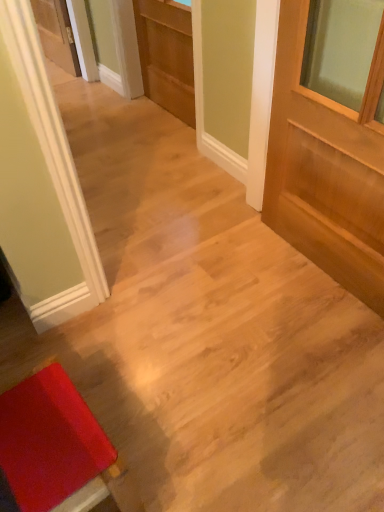
Find the location of a particular element. The height and width of the screenshot is (512, 384). rubberized red stool at lower left is located at coordinates (58, 449).

Identify the location of light brown wood door at right, which appears as the second door when viewed from the left. The image size is (384, 512). (326, 168).

Between light brown wood door at right, which ranks as the 2th door in back-to-front order, and rubberized red stool at lower left, which one has less height?

With less height is rubberized red stool at lower left.

From the image's perspective, is light brown wood door at right, the first door when ordered from front to back, under rubberized red stool at lower left?

Actually, light brown wood door at right, the first door when ordered from front to back, appears above rubberized red stool at lower left in the image.

Considering the sizes of objects light brown wood door at right, the first door when ordered from front to back, and rubberized red stool at lower left in the image provided, who is bigger, light brown wood door at right, the first door when ordered from front to back, or rubberized red stool at lower left?

Bigger between the two is light brown wood door at right, the first door when ordered from front to back.

From a real-world perspective, which object stands above the other?

light brown wood door at right, which ranks as the first door in right-to-left order, is physically above.

Between light brown wood door at center, acting as the 2th door starting from the front, and rubberized red stool at lower left, which one appears on the right side from the viewer's perspective?

From the viewer's perspective, light brown wood door at center, acting as the 2th door starting from the front, appears more on the right side.

Who is bigger, light brown wood door at center, arranged as the 1th door when viewed from the back, or rubberized red stool at lower left?

light brown wood door at center, arranged as the 1th door when viewed from the back.

Is light brown wood door at center, which ranks as the 2th door in right-to-left order, closer to the viewer compared to rubberized red stool at lower left?

No.

Does light brown wood door at center, acting as the 2th door starting from the front, turn towards rubberized red stool at lower left?

No, light brown wood door at center, acting as the 2th door starting from the front, is not aimed at rubberized red stool at lower left.

Is rubberized red stool at lower left at the left side of light brown wood door at right, which ranks as the 2th door in back-to-front order?

Indeed, rubberized red stool at lower left is positioned on the left side of light brown wood door at right, which ranks as the 2th door in back-to-front order.

From a real-world perspective, is rubberized red stool at lower left positioned under light brown wood door at right, the first door when ordered from front to back, based on gravity?

Indeed, from a real-world perspective, rubberized red stool at lower left is positioned beneath light brown wood door at right, the first door when ordered from front to back.

Which object is thinner, rubberized red stool at lower left or light brown wood door at right, which ranks as the 2th door in back-to-front order?

Thinner between the two is light brown wood door at right, which ranks as the 2th door in back-to-front order.

Is light brown wood door at right, which is counted as the second door, starting from the top, next to light brown wood door at center, arranged as the 1th door when viewed from the left, and touching it?

light brown wood door at right, which is counted as the second door, starting from the top, is not next to light brown wood door at center, arranged as the 1th door when viewed from the left, and they're not touching.

From the image's perspective, is light brown wood door at right, which ranks as the first door in right-to-left order, located above light brown wood door at center, arranged as the 1th door when viewed from the back?

No.

Which object is wider, light brown wood door at right, which appears as the second door when viewed from the left, or light brown wood door at center, arranged as the 1th door when viewed from the left?

Wider between the two is light brown wood door at right, which appears as the second door when viewed from the left.

From a real-world perspective, is light brown wood door at center, which ranks as the 2th door in right-to-left order, physically below light brown wood door at right, which is counted as the second door, starting from the top?

Yes, from a real-world perspective, light brown wood door at center, which ranks as the 2th door in right-to-left order, is under light brown wood door at right, which is counted as the second door, starting from the top.

Is there a large distance between light brown wood door at center, the first door positioned from the top, and light brown wood door at right, which ranks as the 2th door in back-to-front order?

Yes, light brown wood door at center, the first door positioned from the top, and light brown wood door at right, which ranks as the 2th door in back-to-front order, are quite far apart.

Identify the location of door located below the light brown wood door at center, arranged as the 1th door when viewed from the back (from the image's perspective). (x=326, y=168).

From the image's perspective, which one is positioned higher, light brown wood door at center, acting as the 2th door starting from the front, or light brown wood door at right, which appears as the second door when viewed from the left?

light brown wood door at center, acting as the 2th door starting from the front.

From the picture: Is rubberized red stool at lower left spatially inside light brown wood door at center, which ranks as the 2th door in right-to-left order, or outside of it?

rubberized red stool at lower left is located beyond the bounds of light brown wood door at center, which ranks as the 2th door in right-to-left order.

Between rubberized red stool at lower left and light brown wood door at center, arranged as the 1th door when viewed from the back, which one has smaller size?

With smaller size is rubberized red stool at lower left.

From a real-world perspective, between rubberized red stool at lower left and light brown wood door at center, the second door from the bottom, who is vertically lower?

In real-world perspective, rubberized red stool at lower left is lower.

This screenshot has height=512, width=384. In order to click on the 2nd door to the right when counting from the rubberized red stool at lower left in this screenshot , I will do `click(326, 168)`.

Find the location of a particular element. This screenshot has width=384, height=512. furniture that appears below the light brown wood door at center, the first door positioned from the top (from the image's perspective) is located at coordinates (58, 449).

Considering their positions, is rubberized red stool at lower left positioned closer to light brown wood door at right, the 1th door from the bottom, than light brown wood door at center, which ranks as the 2th door in right-to-left order?

light brown wood door at center, which ranks as the 2th door in right-to-left order, lies closer to light brown wood door at right, the 1th door from the bottom, than the other object.

From the image, which object appears to be farther from light brown wood door at center, the first door positioned from the top, light brown wood door at right, which ranks as the first door in right-to-left order, or rubberized red stool at lower left?

Among the two, rubberized red stool at lower left is located further to light brown wood door at center, the first door positioned from the top.

Which object lies nearer to the anchor point light brown wood door at center, the first door positioned from the top, rubberized red stool at lower left or light brown wood door at right, the first door when ordered from front to back?

The object closer to light brown wood door at center, the first door positioned from the top, is light brown wood door at right, the first door when ordered from front to back.

Considering their positions, is light brown wood door at center, arranged as the 1th door when viewed from the left, positioned further to rubberized red stool at lower left than light brown wood door at right, which appears as the second door when viewed from the left?

light brown wood door at center, arranged as the 1th door when viewed from the left, is positioned further to the anchor rubberized red stool at lower left.

When comparing their distances from rubberized red stool at lower left, does light brown wood door at right, which is counted as the second door, starting from the top, or light brown wood door at center, arranged as the 1th door when viewed from the left, seem closer?

The object closer to rubberized red stool at lower left is light brown wood door at right, which is counted as the second door, starting from the top.

When comparing their distances from light brown wood door at right, which ranks as the first door in right-to-left order, does light brown wood door at center, acting as the 2th door starting from the front, or rubberized red stool at lower left seem further?

rubberized red stool at lower left is further to light brown wood door at right, which ranks as the first door in right-to-left order.

Find the location of a particular element. The image size is (384, 512). door between light brown wood door at center, the second door from the bottom, and rubberized red stool at lower left, in the vertical direction is located at coordinates (326, 168).